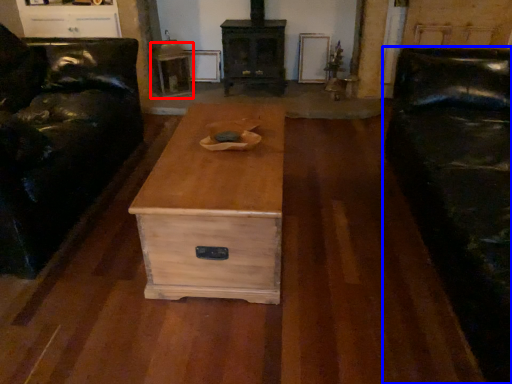
Question: Which point is further to the camera, side table (highlighted by a red box) or studio couch (highlighted by a blue box)?

Choices:
 (A) side table
 (B) studio couch

Answer: (A)